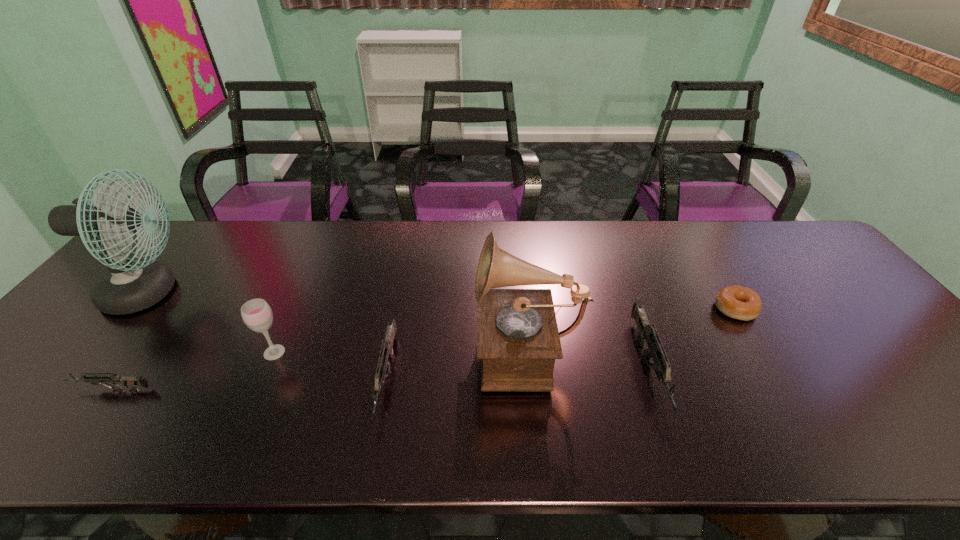
You are a GUI agent. You are given a task and a screenshot of the screen. Output one action in this format:
    pyautogui.click(x=<x>, y=<y>)
    Task: Click on the empty space that is in between the fan and the fifth object from left to right
    This screenshot has height=540, width=960.
    Given the screenshot: What is the action you would take?
    pyautogui.click(x=337, y=320)

Where is `vacant area that lies between the fan and the record player`? This screenshot has width=960, height=540. vacant area that lies between the fan and the record player is located at coordinates (337, 320).

Locate an element on the screen. The image size is (960, 540). vacant region between the sixth object from left to right and the fan is located at coordinates (399, 331).

This screenshot has width=960, height=540. In order to click on vacant space in between the fourth object from right to left and the fifth object from left to right in this screenshot , I will do pyautogui.click(x=456, y=363).

Locate an element on the screen. The image size is (960, 540). free spot between the third object from right to left and the sixth object from left to right is located at coordinates (588, 358).

Locate which object ranks in proximity to the fan. Please provide its 2D coordinates. Your answer should be formatted as a tuple, i.e. [(x, y)], where the tuple contains the x and y coordinates of a point satisfying the conditions above.

[(129, 382)]

Identify which object is the second nearest to the fan. Please provide its 2D coordinates. Your answer should be formatted as a tuple, i.e. [(x, y)], where the tuple contains the x and y coordinates of a point satisfying the conditions above.

[(257, 315)]

Select which gun appears as the closest to the sixth object from left to right. Please provide its 2D coordinates. Your answer should be formatted as a tuple, i.e. [(x, y)], where the tuple contains the x and y coordinates of a point satisfying the conditions above.

[(383, 367)]

Find the location of a particular element. This screenshot has height=540, width=960. the closest gun to the leftmost gun is located at coordinates (383, 367).

I want to click on vacant position in the image that satisfies the following two spatial constraints: 1. on the front side of the rightmost object; 2. on the horn of the record player, so click(x=758, y=347).